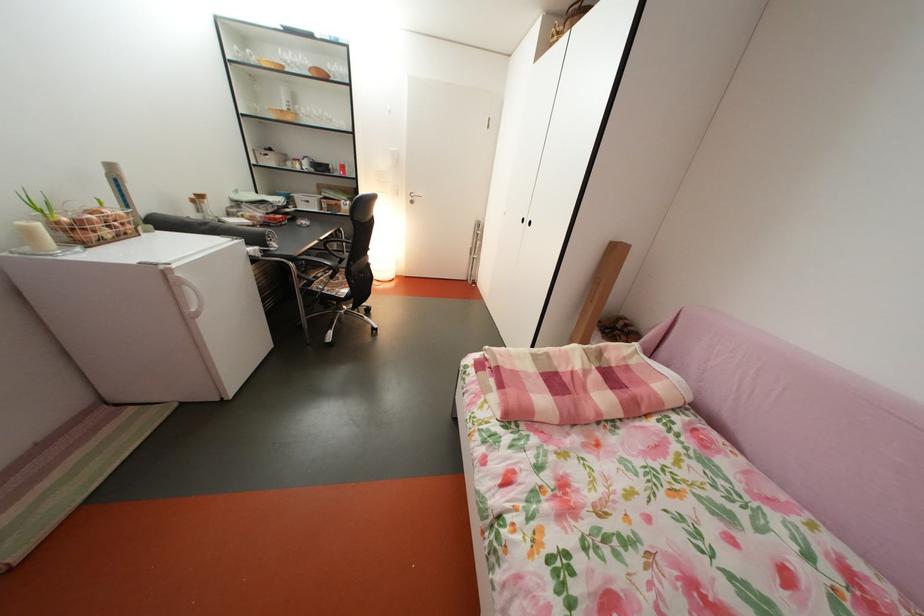
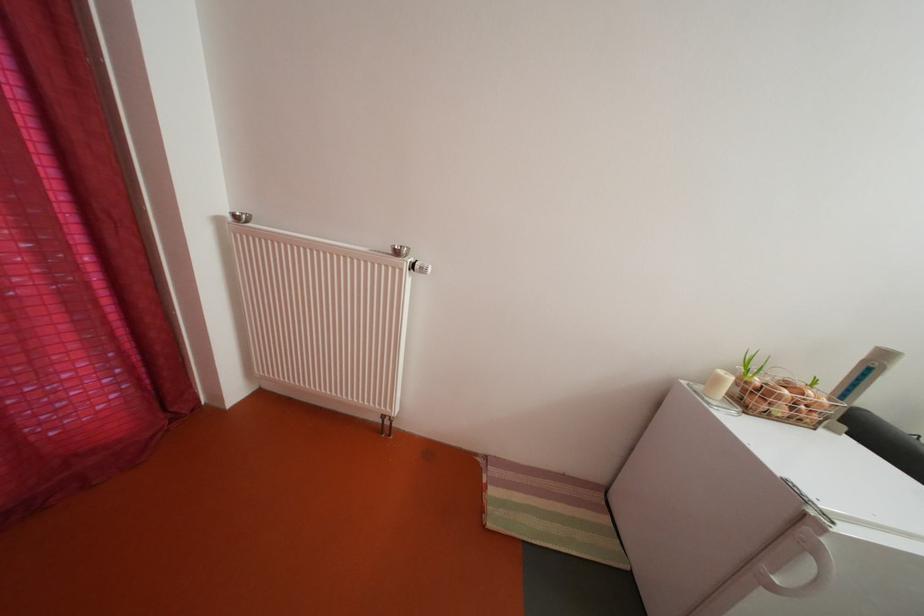
Based on the continuous images, in which direction is the camera rotating?

The rotation direction of the camera is left-down.